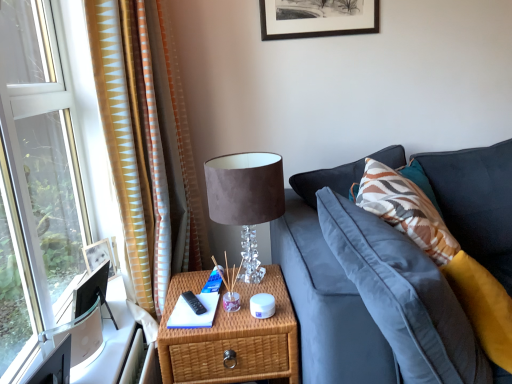
Question: From a real-world perspective, is woven wood nightstand at center physically above gold-patterned fabric curtain at left?

Choices:
 (A) no
 (B) yes

Answer: (A)

Question: Is woven wood nightstand at center not within gold-patterned fabric curtain at left?

Choices:
 (A) no
 (B) yes

Answer: (B)

Question: From the image's perspective, is woven wood nightstand at center on gold-patterned fabric curtain at left?

Choices:
 (A) yes
 (B) no

Answer: (B)

Question: Does woven wood nightstand at center have a greater height compared to gold-patterned fabric curtain at left?

Choices:
 (A) yes
 (B) no

Answer: (B)

Question: Could gold-patterned fabric curtain at left be considered to be inside woven wood nightstand at center?

Choices:
 (A) yes
 (B) no

Answer: (B)

Question: Considering the relative sizes of woven wood nightstand at center and gold-patterned fabric curtain at left in the image provided, is woven wood nightstand at center wider than gold-patterned fabric curtain at left?

Choices:
 (A) yes
 (B) no

Answer: (A)

Question: Is the position of velvet lampshade at upper center less distant than that of woven wood nightstand at center?

Choices:
 (A) yes
 (B) no

Answer: (B)

Question: Is velvet lampshade at upper center positioned far away from woven wood nightstand at center?

Choices:
 (A) yes
 (B) no

Answer: (B)

Question: From the image's perspective, is velvet lampshade at upper center above woven wood nightstand at center?

Choices:
 (A) yes
 (B) no

Answer: (A)

Question: Does velvet lampshade at upper center touch woven wood nightstand at center?

Choices:
 (A) no
 (B) yes

Answer: (A)

Question: From a real-world perspective, is velvet lampshade at upper center under woven wood nightstand at center?

Choices:
 (A) yes
 (B) no

Answer: (B)

Question: Can you confirm if velvet lampshade at upper center is smaller than woven wood nightstand at center?

Choices:
 (A) no
 (B) yes

Answer: (B)

Question: Would you say gold-patterned fabric curtain at left is outside velvet lampshade at upper center?

Choices:
 (A) no
 (B) yes

Answer: (B)